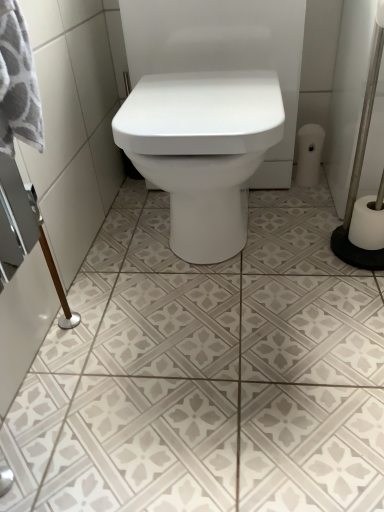
Where is `free space to the left of white matte toilet paper at right, acting as the 2th toilet paper starting from the back`? This screenshot has width=384, height=512. free space to the left of white matte toilet paper at right, acting as the 2th toilet paper starting from the back is located at coordinates (307, 250).